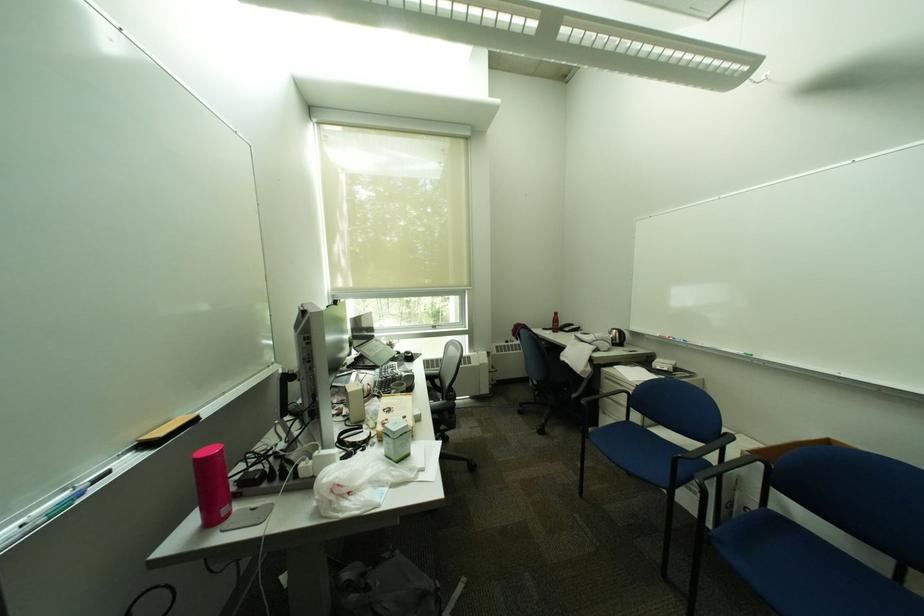
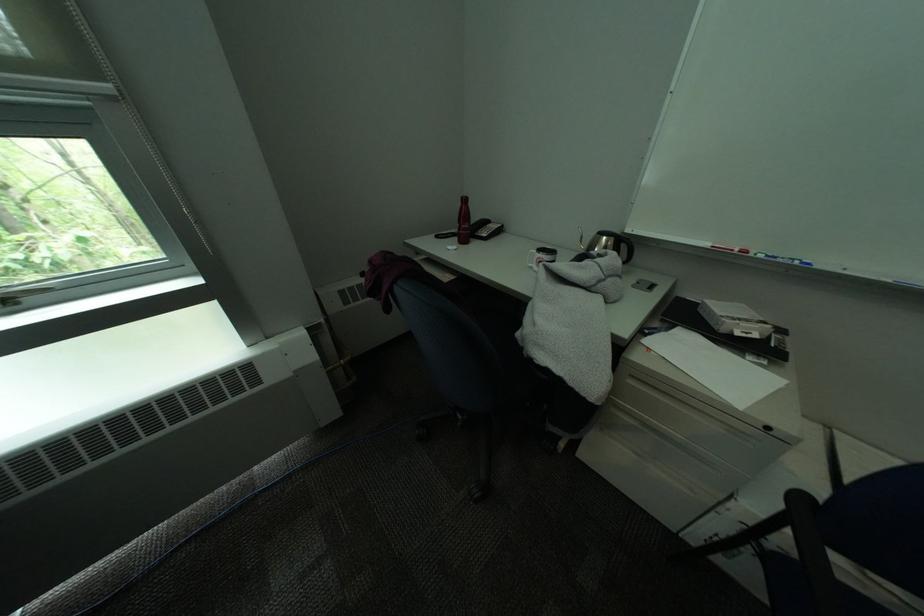
Where in the second image is the point corresponding to pixel 445 328 from the first image?

(15, 302)